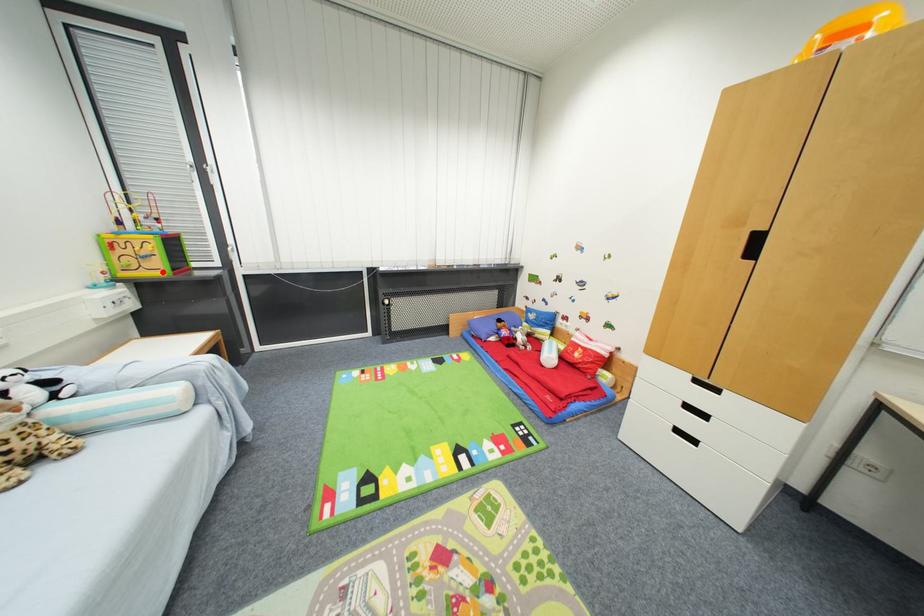
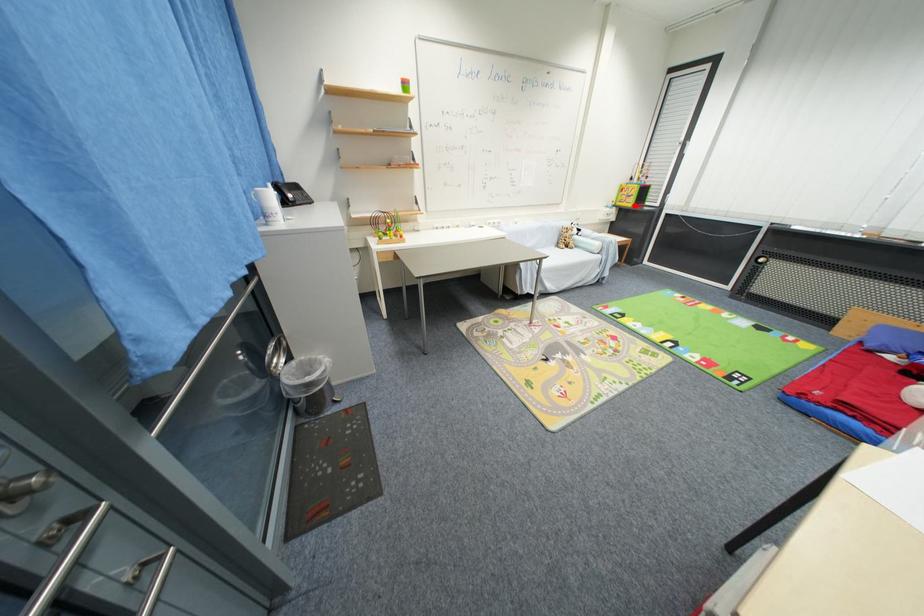
I am providing you with two images of the same scene from different viewpoints. A red point is marked on the first image and another point is marked on the second image. Is the red point in image1 aligned with the point shown in image2?

Yes